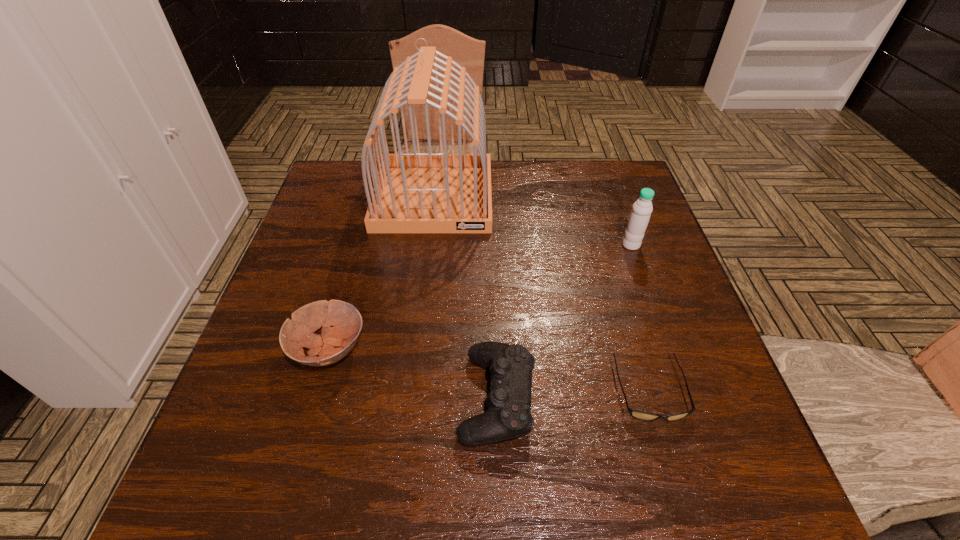
Select which object is the closest to the water bottle. Please provide its 2D coordinates. Your answer should be formatted as a tuple, i.e. [(x, y)], where the tuple contains the x and y coordinates of a point satisfying the conditions above.

[(641, 415)]

Identify which object is the second nearest to the shortest object. Please provide its 2D coordinates. Your answer should be formatted as a tuple, i.e. [(x, y)], where the tuple contains the x and y coordinates of a point satisfying the conditions above.

[(639, 217)]

This screenshot has width=960, height=540. I want to click on vacant space that satisfies the following two spatial constraints: 1. on the front side of the control; 2. on the right side of the bowl, so click(x=316, y=397).

What are the coordinates of `vacant position in the image that satisfies the following two spatial constraints: 1. with an open door on the second farthest object; 2. on the right side of the tallest object` in the screenshot? It's located at (428, 245).

Where is `vacant space that satisfies the following two spatial constraints: 1. with an open door on the second farthest object; 2. on the left side of the farthest object`? The width and height of the screenshot is (960, 540). vacant space that satisfies the following two spatial constraints: 1. with an open door on the second farthest object; 2. on the left side of the farthest object is located at coordinates (428, 245).

The width and height of the screenshot is (960, 540). What are the coordinates of `free space that satisfies the following two spatial constraints: 1. with an open door on the control; 2. on the left side of the farthest object` in the screenshot? It's located at (410, 397).

This screenshot has height=540, width=960. I want to click on free space in the image that satisfies the following two spatial constraints: 1. with an open door on the farthest object; 2. on the right side of the second farthest object, so click(x=428, y=245).